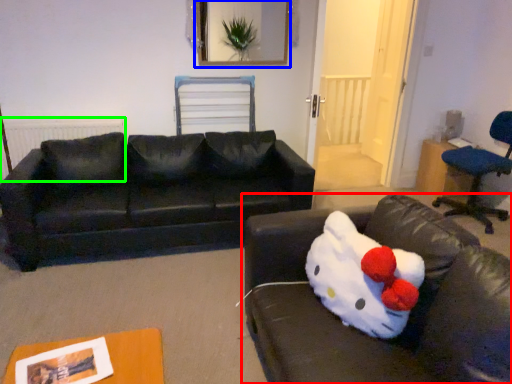
Question: Estimate the real-world distances between objects in this image. Which object is closer to studio couch (highlighted by a red box), picture frame (highlighted by a blue box) or radiator (highlighted by a green box)?

Choices:
 (A) picture frame
 (B) radiator

Answer: (B)